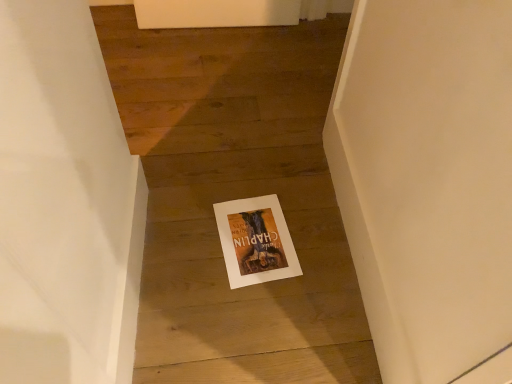
The height and width of the screenshot is (384, 512). Find the location of `free location to the right of white paper at center`. free location to the right of white paper at center is located at coordinates (318, 243).